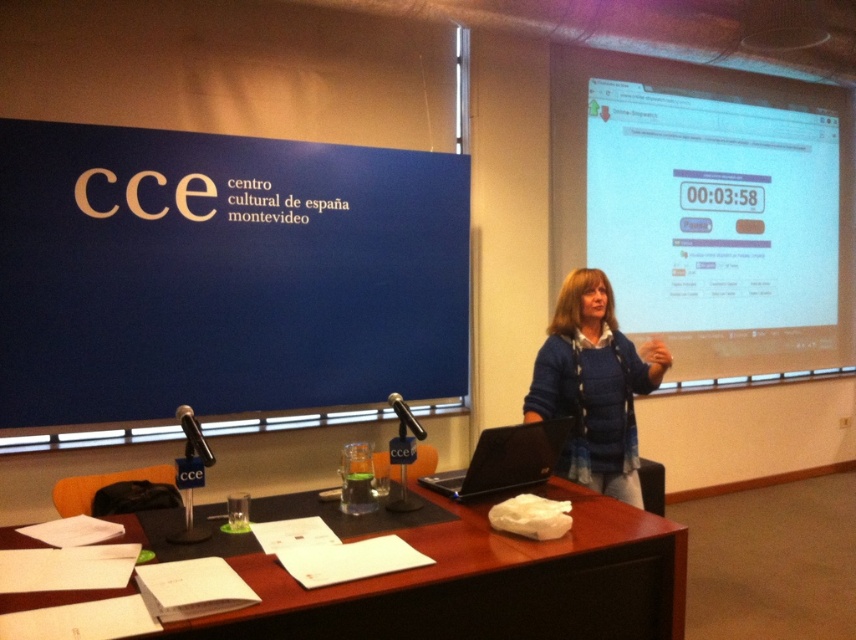
Question: Which object appears closest to the camera in this image?

Choices:
 (A) white glossy projection screen at upper right
 (B) brown wooden table at center
 (C) black plastic laptop at center
 (D) blue knitted sweater at center

Answer: (B)

Question: Does blue knitted sweater at center lie behind black plastic laptop at center?

Choices:
 (A) yes
 (B) no

Answer: (A)

Question: From the image, what is the correct spatial relationship of white glossy projection screen at upper right in relation to black plastic laptop at center?

Choices:
 (A) below
 (B) above

Answer: (B)

Question: Which point is farther to the camera?

Choices:
 (A) (629, 164)
 (B) (566, 404)
 (C) (521, 476)

Answer: (A)

Question: Can you confirm if white glossy projection screen at upper right is positioned above blue knitted sweater at center?

Choices:
 (A) yes
 (B) no

Answer: (A)

Question: Which point appears closest to the camera in this image?

Choices:
 (A) (581, 188)
 (B) (431, 484)

Answer: (B)